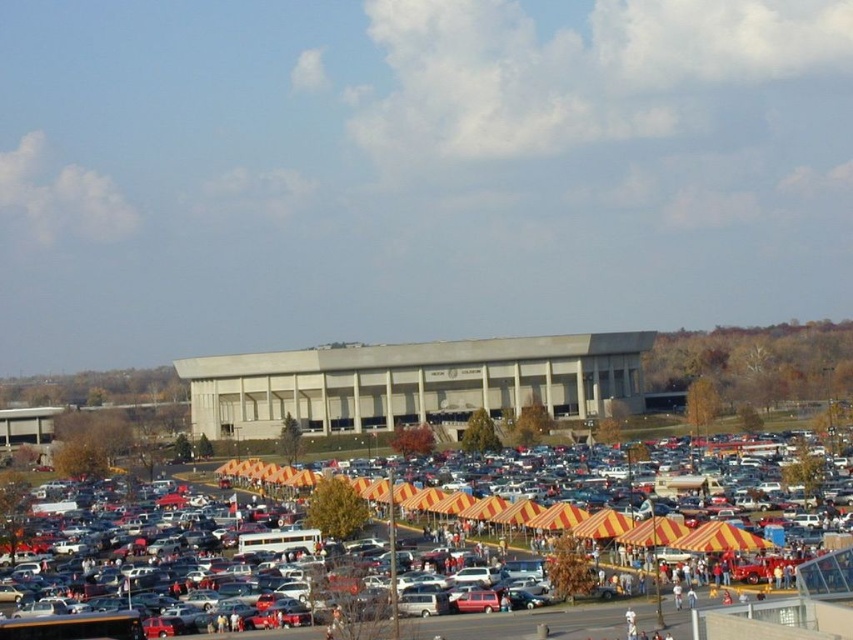
Between yellow striped tents at center and beige concrete building at center, which one appears on the left side from the viewer's perspective?

From the viewer's perspective, beige concrete building at center appears more on the left side.

At what (x,y) coordinates should I click in order to perform the action: click on yellow striped tents at center. Please return your answer as a coordinate pair (x, y). Looking at the image, I should click on (398, 556).

Describe the element at coordinates (398, 556) in the screenshot. The height and width of the screenshot is (640, 853). I see `yellow striped tents at center` at that location.

The width and height of the screenshot is (853, 640). I want to click on yellow striped tents at center, so click(398, 556).